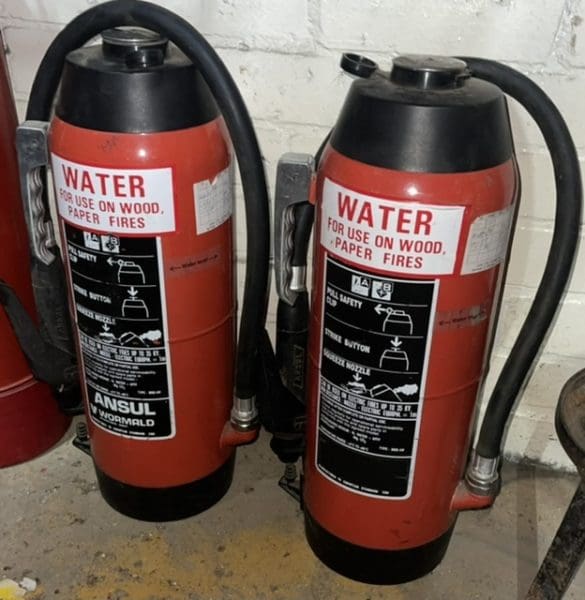
This screenshot has height=600, width=585. Identify the location of chair leg. (559, 548).